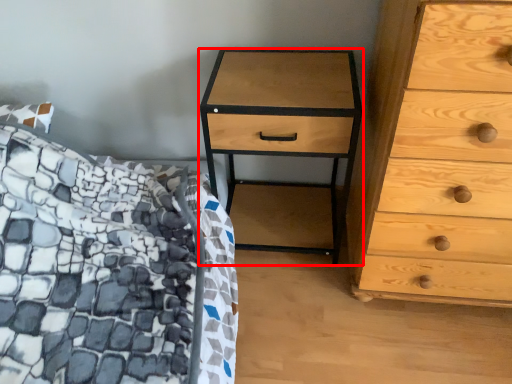
Question: From the image's perspective, where is nightstand (annotated by the red box) located relative to chest of drawers?

Choices:
 (A) above
 (B) below

Answer: (B)